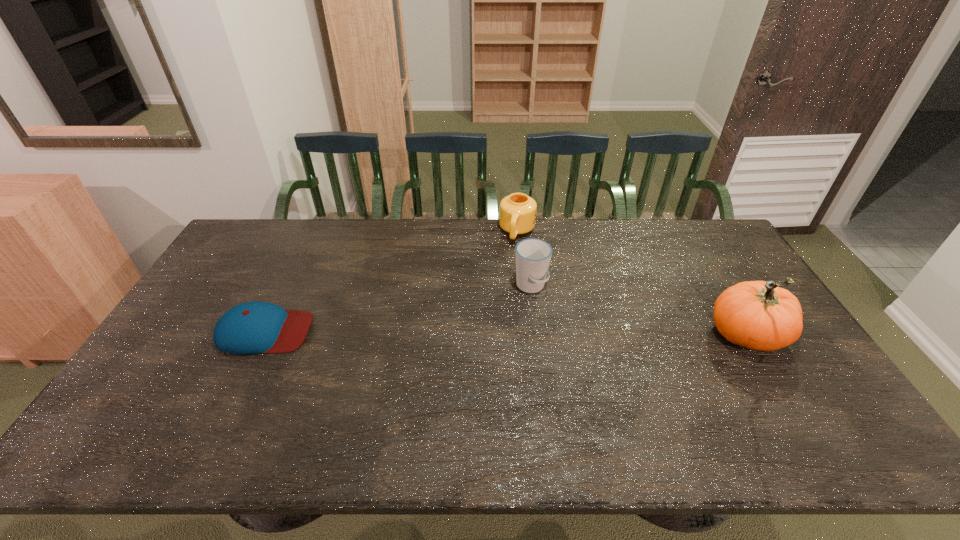
You are a GUI agent. You are given a task and a screenshot of the screen. Output one action in this format:
    pyautogui.click(x=<x>, y=<y>)
    Task: Click on the baseball cap
    This screenshot has height=540, width=960.
    Given the screenshot: What is the action you would take?
    pyautogui.click(x=256, y=327)

Locate an element on the screen. The image size is (960, 540). the leftmost object is located at coordinates (256, 327).

Find the location of `pumpkin`. pumpkin is located at coordinates point(758,315).

Where is `the rightmost object`? This screenshot has width=960, height=540. the rightmost object is located at coordinates (758, 315).

This screenshot has width=960, height=540. I want to click on the second farthest object, so click(533, 256).

This screenshot has width=960, height=540. What are the coordinates of `the farthest object` in the screenshot? It's located at (517, 211).

The image size is (960, 540). Find the location of `free space located 0.150m with the bill of the leftmost object facing forward`. free space located 0.150m with the bill of the leftmost object facing forward is located at coordinates (363, 331).

Identify the location of vacant area situated 0.320m on the left of the pumpkin. This screenshot has width=960, height=540. (596, 336).

This screenshot has height=540, width=960. In order to click on free space located with a handle on the side of the second farthest object in this screenshot , I will do `click(546, 313)`.

Identify the location of vacant space located 0.190m with a handle on the side of the second farthest object. This screenshot has width=960, height=540. (566, 344).